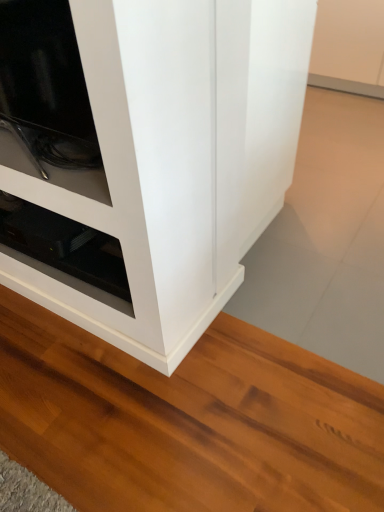
This screenshot has height=512, width=384. I want to click on blank space situated above black glossy shelf at lower left (from a real-world perspective), so click(68, 248).